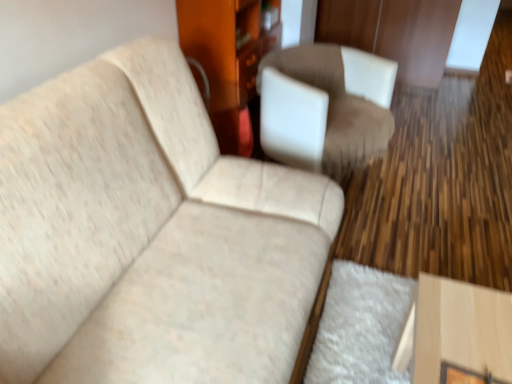
Measure the distance between point (159, 112) and camera.

Point (159, 112) and camera are 1.58 meters apart.

The image size is (512, 384). What are the coordinates of `suede-like brown chair at center` in the screenshot? It's located at (325, 107).

This screenshot has width=512, height=384. What do you see at coordinates (325, 107) in the screenshot?
I see `suede-like brown chair at center` at bounding box center [325, 107].

Where is `beige fabric couch at upper left`? This screenshot has height=384, width=512. beige fabric couch at upper left is located at coordinates (149, 234).

Does beige fabric couch at upper left lie behind wooden dresser at center?

No, beige fabric couch at upper left is closer to the viewer.

Can you confirm if beige fabric couch at upper left is wider than wooden dresser at center?

Indeed, beige fabric couch at upper left has a greater width compared to wooden dresser at center.

Can you see beige fabric couch at upper left touching wooden dresser at center?

There is a gap between beige fabric couch at upper left and wooden dresser at center.

Is suede-like brown chair at center smaller than beige fabric couch at upper left?

Yes, suede-like brown chair at center is smaller than beige fabric couch at upper left.

Is suede-like brown chair at center beside beige fabric couch at upper left?

There is a gap between suede-like brown chair at center and beige fabric couch at upper left.

Who is shorter, suede-like brown chair at center or beige fabric couch at upper left?

suede-like brown chair at center.

The height and width of the screenshot is (384, 512). I want to click on studio couch on the left of suede-like brown chair at center, so click(x=149, y=234).

Is suede-like brown chair at center looking in the opposite direction of wooden dresser at center?

That's right, suede-like brown chair at center is facing away from wooden dresser at center.

Who is more distant, suede-like brown chair at center or wooden dresser at center?

wooden dresser at center.

Considering the sizes of objects suede-like brown chair at center and wooden dresser at center in the image provided, who is thinner, suede-like brown chair at center or wooden dresser at center?

Thinner between the two is wooden dresser at center.

Which is less distant, [326,120] or [234,81]?

Point [326,120].

Between beige fabric couch at upper left and suede-like brown chair at center, which one appears on the left side from the viewer's perspective?

Positioned to the left is beige fabric couch at upper left.

Between beige fabric couch at upper left and suede-like brown chair at center, which one has larger width?

Wider between the two is beige fabric couch at upper left.

Is beige fabric couch at upper left not close to suede-like brown chair at center?

They are positioned close to each other.

Is beige fabric couch at upper left oriented towards suede-like brown chair at center?

No, beige fabric couch at upper left is not facing towards suede-like brown chair at center.

Is wooden dresser at center located outside suede-like brown chair at center?

Yes, wooden dresser at center is outside of suede-like brown chair at center.

Is wooden dresser at center taller or shorter than suede-like brown chair at center?

wooden dresser at center is taller than suede-like brown chair at center.

Looking at the image, does wooden dresser at center seem bigger or smaller compared to suede-like brown chair at center?

wooden dresser at center is bigger than suede-like brown chair at center.

Is the position of wooden dresser at center less distant than that of suede-like brown chair at center?

No, wooden dresser at center is further to the viewer.

Is beige fabric couch at upper left surrounded by wooden dresser at center?

Actually, beige fabric couch at upper left is outside wooden dresser at center.

The height and width of the screenshot is (384, 512). Find the location of `dresser on the right of the beige fabric couch at upper left`. dresser on the right of the beige fabric couch at upper left is located at coordinates (228, 62).

Which is nearer, (247, 129) or (113, 153)?

Positioned in front is point (113, 153).

Locate an element on the screen. dresser behind the beige fabric couch at upper left is located at coordinates (228, 62).

The height and width of the screenshot is (384, 512). In order to click on studio couch in front of the suede-like brown chair at center in this screenshot , I will do `click(149, 234)`.

Estimate the real-world distances between objects in this image. Which object is closer to wooden dresser at center, beige fabric couch at upper left or suede-like brown chair at center?

The object closer to wooden dresser at center is suede-like brown chair at center.

Considering their positions, is wooden dresser at center positioned closer to beige fabric couch at upper left than suede-like brown chair at center?

suede-like brown chair at center lies closer to beige fabric couch at upper left than the other object.

Consider the image. Which object lies nearer to the anchor point suede-like brown chair at center, beige fabric couch at upper left or wooden dresser at center?

wooden dresser at center lies closer to suede-like brown chair at center than the other object.

From the image, which object appears to be nearer to suede-like brown chair at center, wooden dresser at center or beige fabric couch at upper left?

wooden dresser at center lies closer to suede-like brown chair at center than the other object.

Which object lies further to the anchor point wooden dresser at center, suede-like brown chair at center or beige fabric couch at upper left?

Based on the image, beige fabric couch at upper left appears to be further to wooden dresser at center.

From the picture: Looking at the image, which one is located closer to beige fabric couch at upper left, suede-like brown chair at center or wooden dresser at center?

suede-like brown chair at center is closer to beige fabric couch at upper left.

Locate an element on the screen. This screenshot has height=384, width=512. chair positioned between beige fabric couch at upper left and wooden dresser at center from near to far is located at coordinates (325, 107).